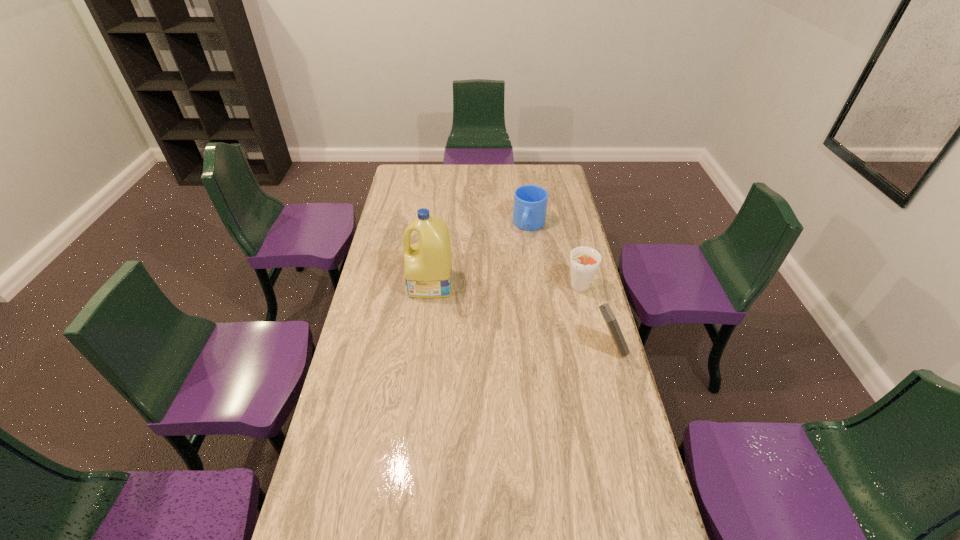
The image size is (960, 540). Find the location of `detergent`. detergent is located at coordinates (428, 264).

The image size is (960, 540). I want to click on the leftmost object, so click(428, 264).

I want to click on the nearest object, so click(610, 319).

The height and width of the screenshot is (540, 960). I want to click on root beer, so click(584, 261).

Identify the location of the shortest object. (530, 201).

I want to click on mug, so click(530, 201).

The width and height of the screenshot is (960, 540). In order to click on free region located 0.050m on the label of the tallest object in this screenshot , I will do `click(396, 285)`.

This screenshot has height=540, width=960. Identify the location of vacant space located 0.310m on the drink side of the root beer. pyautogui.click(x=503, y=330).

I want to click on vacant region located 0.270m on the drink side of the root beer, so click(512, 325).

Identify the location of free space located on the drink side of the root beer. (527, 317).